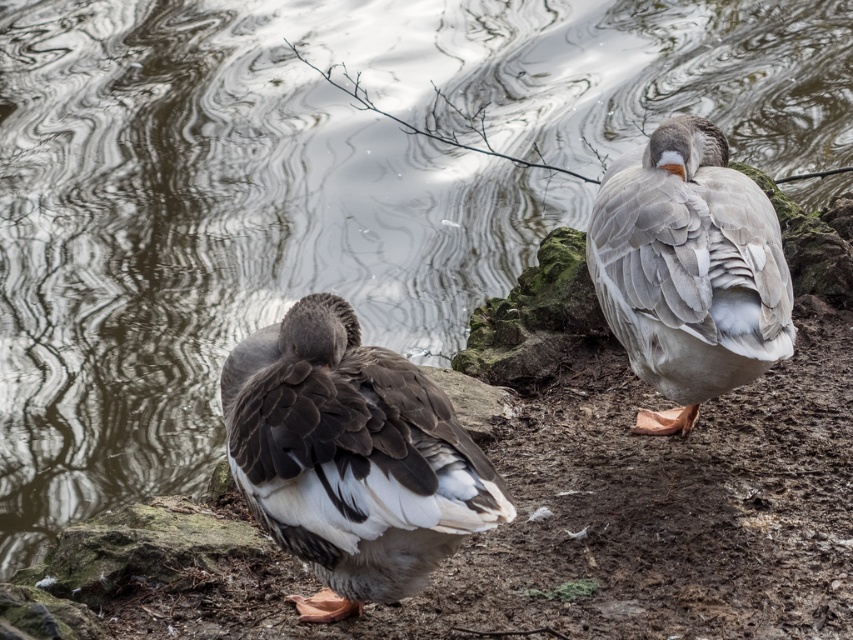
Question: Considering the relative positions of brown feathered duck at center and gray feathered goose at right in the image provided, where is brown feathered duck at center located with respect to gray feathered goose at right?

Choices:
 (A) above
 (B) below

Answer: (B)

Question: Can you confirm if brown feathered duck at center is positioned above gray feathered goose at right?

Choices:
 (A) no
 (B) yes

Answer: (A)

Question: Is brown feathered duck at center thinner than gray feathered goose at right?

Choices:
 (A) no
 (B) yes

Answer: (A)

Question: Which point is closer to the camera?

Choices:
 (A) (294, 420)
 (B) (675, 401)

Answer: (A)

Question: Which of the following is the farthest from the observer?

Choices:
 (A) gray feathered goose at right
 (B) brown feathered duck at center

Answer: (A)

Question: Which object is farther from the camera taking this photo?

Choices:
 (A) brown feathered duck at center
 (B) gray feathered goose at right

Answer: (B)